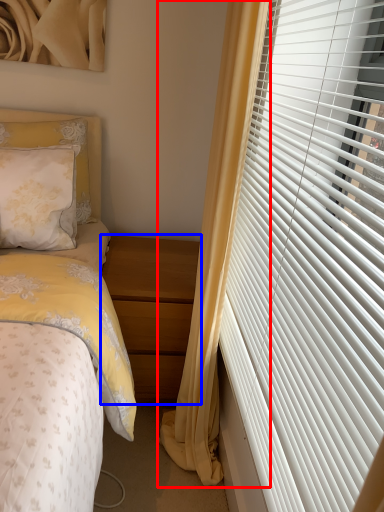
Question: Which point is closer to the camera, curtain (highlighted by a red box) or nightstand (highlighted by a blue box)?

Choices:
 (A) curtain
 (B) nightstand

Answer: (A)